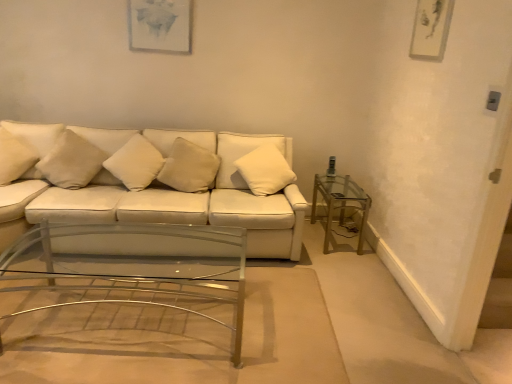
What do you see at coordinates (135, 163) in the screenshot? This screenshot has width=512, height=384. I see `white soft cushion at center, the third pillow positioned from the left` at bounding box center [135, 163].

In order to face white soft pillow at center, the 1th pillow from the right, should I rotate leftwards or rightwards?

You should look right and rotate roughly 1.658 degrees.

Describe the element at coordinates (175, 188) in the screenshot. I see `white leather couch at center` at that location.

Find the location of a particular element. This screenshot has width=512, height=384. white soft cushion at center, the third pillow positioned from the left is located at coordinates (135, 163).

From the picture: Is white soft cushion at center, which ranks as the 3th pillow in right-to-left order, positioned in front of white soft pillow at center, which appears as the fifth pillow when viewed from the left?

Yes, white soft cushion at center, which ranks as the 3th pillow in right-to-left order, is in front of white soft pillow at center, which appears as the fifth pillow when viewed from the left.

Considering the relative sizes of white soft cushion at center, which ranks as the 3th pillow in right-to-left order, and white soft pillow at center, the 1th pillow from the right, in the image provided, is white soft cushion at center, which ranks as the 3th pillow in right-to-left order, shorter than white soft pillow at center, the 1th pillow from the right,?

Correct, white soft cushion at center, which ranks as the 3th pillow in right-to-left order, is not as tall as white soft pillow at center, the 1th pillow from the right.

Between white soft cushion at center, the third pillow positioned from the left, and white soft pillow at center, which appears as the fifth pillow when viewed from the left, which one appears on the right side from the viewer's perspective?

white soft pillow at center, which appears as the fifth pillow when viewed from the left.

Does point (121, 166) come closer to viewer compared to point (261, 155)?

Yes, point (121, 166) is closer to viewer.

What's the angular difference between white matte pillow at left, positioned as the fifth pillow in right-to-left order, and beige fabric pillow at center, which is the 4th pillow from left to right,'s facing directions?

There is a 26.2-degree angle between the facing directions of white matte pillow at left, positioned as the fifth pillow in right-to-left order, and beige fabric pillow at center, which is the 4th pillow from left to right.

Which of these two, white matte pillow at left, marked as the first pillow in a left-to-right arrangement, or beige fabric pillow at center, arranged as the 2th pillow when viewed from the right, is smaller?

beige fabric pillow at center, arranged as the 2th pillow when viewed from the right.

In the scene shown: Are white matte pillow at left, positioned as the fifth pillow in right-to-left order, and beige fabric pillow at center, arranged as the 2th pillow when viewed from the right, making contact?

No, white matte pillow at left, positioned as the fifth pillow in right-to-left order, is not beside beige fabric pillow at center, arranged as the 2th pillow when viewed from the right.

Is white matte pillow at left, marked as the first pillow in a left-to-right arrangement, further to camera compared to beige fabric pillow at center, arranged as the 2th pillow when viewed from the right?

No, it is not.

Is white leather couch at center not near white soft cushion at center, the third pillow positioned from the left?

white leather couch at center is actually quite close to white soft cushion at center, the third pillow positioned from the left.

Which is correct: white leather couch at center is inside white soft cushion at center, which ranks as the 3th pillow in right-to-left order, or outside of it?

white leather couch at center is located beyond the bounds of white soft cushion at center, which ranks as the 3th pillow in right-to-left order.

Which is in front, point (34, 203) or point (151, 145)?

Point (34, 203)

Can you confirm if clear glass table at right is bigger than white matte pillow at left, positioned as the fifth pillow in right-to-left order?

Yes.

Is clear glass table at right not inside white matte pillow at left, positioned as the fifth pillow in right-to-left order?

That's correct, clear glass table at right is outside of white matte pillow at left, positioned as the fifth pillow in right-to-left order.

Does point (344, 208) lie in front of point (10, 176)?

That is False.

Who is taller, clear glass table at right or white matte pillow at left, positioned as the fifth pillow in right-to-left order?

clear glass table at right is taller.

Which is in front, point (156, 197) or point (72, 132)?

The point (156, 197) is in front.

Can you see white leather couch at center touching beige fabric pillow at left, the second pillow when ordered from left to right?

No, white leather couch at center is not making contact with beige fabric pillow at left, the second pillow when ordered from left to right.

Is white leather couch at center not within beige fabric pillow at left, the second pillow when ordered from left to right?

Yes, white leather couch at center is outside of beige fabric pillow at left, the second pillow when ordered from left to right.

I want to click on studio couch that is on the right side of beige fabric pillow at left, the second pillow when ordered from left to right, so click(x=175, y=188).

From the image's perspective, is white matte pillow at left, positioned as the fifth pillow in right-to-left order, above or below white soft cushion at center, the third pillow positioned from the left?

Based on their image positions, white matte pillow at left, positioned as the fifth pillow in right-to-left order, is located above white soft cushion at center, the third pillow positioned from the left.

Is white matte pillow at left, positioned as the fifth pillow in right-to-left order, next to white soft cushion at center, which ranks as the 3th pillow in right-to-left order?

No, white matte pillow at left, positioned as the fifth pillow in right-to-left order, is not in contact with white soft cushion at center, which ranks as the 3th pillow in right-to-left order.

Does white matte pillow at left, positioned as the fifth pillow in right-to-left order, contain white soft cushion at center, the third pillow positioned from the left?

No, white soft cushion at center, the third pillow positioned from the left, is not a part of white matte pillow at left, positioned as the fifth pillow in right-to-left order.

Considering the sizes of objects white matte pillow at left, positioned as the fifth pillow in right-to-left order, and white soft cushion at center, the third pillow positioned from the left, in the image provided, who is bigger, white matte pillow at left, positioned as the fifth pillow in right-to-left order, or white soft cushion at center, the third pillow positioned from the left,?

With larger size is white soft cushion at center, the third pillow positioned from the left.

Does white soft cushion at center, which ranks as the 3th pillow in right-to-left order, touch white leather couch at center?

white soft cushion at center, which ranks as the 3th pillow in right-to-left order, is not next to white leather couch at center, and they're not touching.

From the picture: Considering their positions, is white soft cushion at center, which ranks as the 3th pillow in right-to-left order, located in front of or behind white leather couch at center?

white soft cushion at center, which ranks as the 3th pillow in right-to-left order, is behind white leather couch at center.

Considering the sizes of objects white soft cushion at center, the third pillow positioned from the left, and white leather couch at center in the image provided, who is bigger, white soft cushion at center, the third pillow positioned from the left, or white leather couch at center?

Bigger between the two is white leather couch at center.

How far apart are white soft cushion at center, which ranks as the 3th pillow in right-to-left order, and white leather couch at center?

white soft cushion at center, which ranks as the 3th pillow in right-to-left order, is 36.83 centimeters away from white leather couch at center.

Identify the location of the 2nd pillow to the right of the white soft cushion at center, which ranks as the 3th pillow in right-to-left order, starting your count from the anchor. Image resolution: width=512 pixels, height=384 pixels. (265, 170).

Where is `the 3rd pillow counting from the left of the beige fabric pillow at center, arranged as the 2th pillow when viewed from the right`? Image resolution: width=512 pixels, height=384 pixels. the 3rd pillow counting from the left of the beige fabric pillow at center, arranged as the 2th pillow when viewed from the right is located at coordinates tap(14, 157).

Looking at the image, which one is located closer to clear glass table at right, white soft pillow at center, the 1th pillow from the right, or white matte pillow at left, marked as the first pillow in a left-to-right arrangement?

The object closer to clear glass table at right is white soft pillow at center, the 1th pillow from the right.

Based on the photo, looking at the image, which one is located further to white leather couch at center, white matte pillow at left, positioned as the fifth pillow in right-to-left order, or beige fabric pillow at left, the second pillow when ordered from left to right?

white matte pillow at left, positioned as the fifth pillow in right-to-left order, is further to white leather couch at center.

From the image, which object appears to be farther from white leather couch at center, clear glass table at right or white matte pillow at left, positioned as the fifth pillow in right-to-left order?

The object further to white leather couch at center is clear glass table at right.

Considering their positions, is white soft pillow at center, which appears as the fifth pillow when viewed from the left, positioned further to beige fabric pillow at center, arranged as the 2th pillow when viewed from the right, than clear glass coffee table at center?

clear glass coffee table at center is further to beige fabric pillow at center, arranged as the 2th pillow when viewed from the right.

Estimate the real-world distances between objects in this image. Which object is further from white soft pillow at center, which appears as the fifth pillow when viewed from the left, clear glass coffee table at center or white leather couch at center?

Based on the image, clear glass coffee table at center appears to be further to white soft pillow at center, which appears as the fifth pillow when viewed from the left.

When comparing their distances from white soft pillow at center, the 1th pillow from the right, does beige fabric pillow at center, which is the 4th pillow from left to right, or white leather couch at center seem further?

Among the two, white leather couch at center is located further to white soft pillow at center, the 1th pillow from the right.

Estimate the real-world distances between objects in this image. Which object is closer to beige fabric pillow at center, which is the 4th pillow from left to right, white soft cushion at center, the third pillow positioned from the left, or beige fabric pillow at left, the 4th pillow in the right-to-left sequence?

white soft cushion at center, the third pillow positioned from the left.

Considering their positions, is beige fabric pillow at center, arranged as the 2th pillow when viewed from the right, positioned closer to white soft cushion at center, the third pillow positioned from the left, than beige fabric pillow at left, the second pillow when ordered from left to right?

Among the two, beige fabric pillow at center, arranged as the 2th pillow when viewed from the right, is located nearer to white soft cushion at center, the third pillow positioned from the left.

The height and width of the screenshot is (384, 512). I want to click on coffee table between beige fabric pillow at left, the 4th pillow in the right-to-left sequence, and white soft pillow at center, which appears as the fifth pillow when viewed from the left, from left to right, so click(131, 269).

The image size is (512, 384). What are the coordinates of `studio couch situated between white soft cushion at center, which ranks as the 3th pillow in right-to-left order, and white soft pillow at center, the 1th pillow from the right, from left to right` in the screenshot? It's located at (175, 188).

Where is `coffee table between white matte pillow at left, positioned as the fifth pillow in right-to-left order, and clear glass table at right, in the horizontal direction`? This screenshot has height=384, width=512. coffee table between white matte pillow at left, positioned as the fifth pillow in right-to-left order, and clear glass table at right, in the horizontal direction is located at coordinates (131, 269).

This screenshot has width=512, height=384. Identify the location of coffee table between white matte pillow at left, marked as the first pillow in a left-to-right arrangement, and beige fabric pillow at center, arranged as the 2th pillow when viewed from the right, in the horizontal direction. (131, 269).